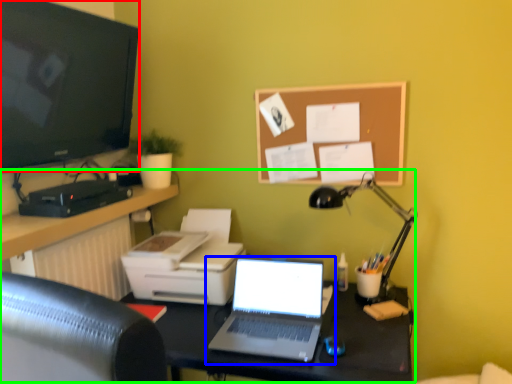
Question: Estimate the real-world distances between objects in this image. Which object is farther from television (highlighted by a red box), laptop (highlighted by a blue box) or entertainment center (highlighted by a green box)?

Choices:
 (A) laptop
 (B) entertainment center

Answer: (A)